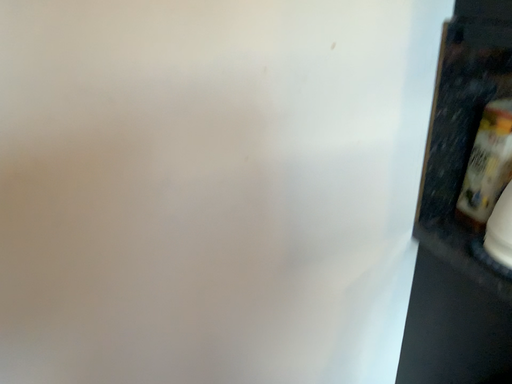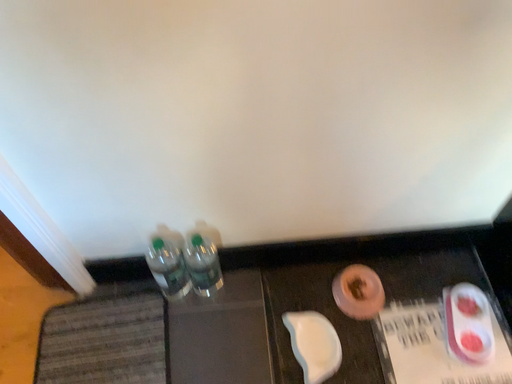
Question: How did the camera likely rotate when shooting the video?

Choices:
 (A) rotated left
 (B) rotated right

Answer: (A)